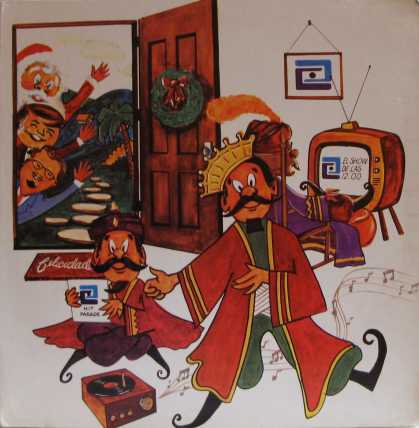
This screenshot has height=428, width=419. In order to click on dark wooden open door in this screenshot , I will do `click(183, 56)`.